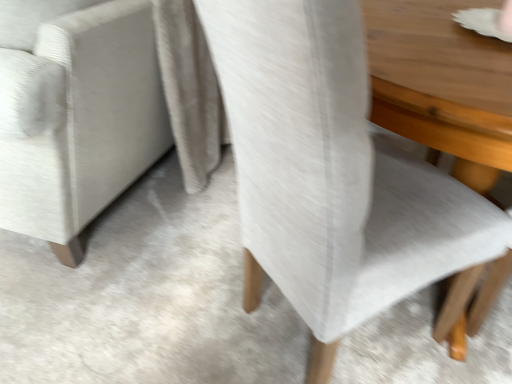
Identify the location of light gray fabric chair at center. (333, 175).

What do you see at coordinates (333, 175) in the screenshot? The width and height of the screenshot is (512, 384). I see `light gray fabric chair at center` at bounding box center [333, 175].

In order to face light gray fabric chair at center, should I rotate leftwards or rightwards?

Turn right by 15.005 degrees to look at light gray fabric chair at center.

The image size is (512, 384). Find the location of `light gray fabric chair at center`. light gray fabric chair at center is located at coordinates 333,175.